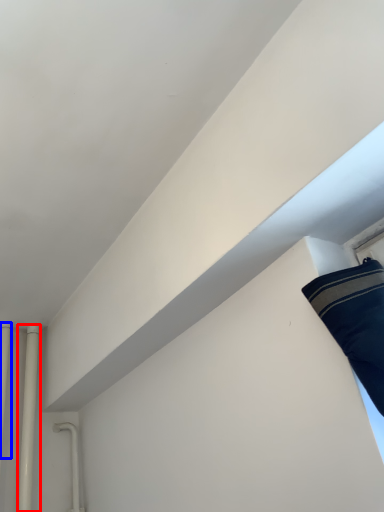
Question: Which object is closer to the camera taking this photo, pipe (highlighted by a red box) or pipe (highlighted by a blue box)?

Choices:
 (A) pipe
 (B) pipe

Answer: (B)